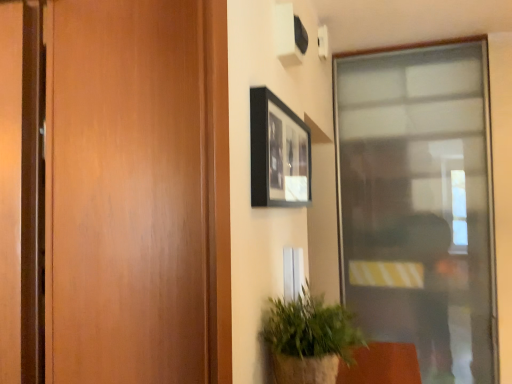
Question: Can you confirm if black matte picture frame at upper center is smaller than transparent glass door at right?

Choices:
 (A) no
 (B) yes

Answer: (B)

Question: From the image's perspective, does black matte picture frame at upper center appear higher than transparent glass door at right?

Choices:
 (A) no
 (B) yes

Answer: (B)

Question: Could transparent glass door at right be considered to be inside black matte picture frame at upper center?

Choices:
 (A) yes
 (B) no

Answer: (B)

Question: Does black matte picture frame at upper center have a greater height compared to transparent glass door at right?

Choices:
 (A) yes
 (B) no

Answer: (B)

Question: Can you confirm if black matte picture frame at upper center is wider than transparent glass door at right?

Choices:
 (A) no
 (B) yes

Answer: (A)

Question: From a real-world perspective, relative to transparent glass door at right, is black matte picture frame at upper center vertically above or below?

Choices:
 (A) below
 (B) above

Answer: (B)

Question: Considering the positions of black matte picture frame at upper center and transparent glass door at right in the image, is black matte picture frame at upper center wider or thinner than transparent glass door at right?

Choices:
 (A) thin
 (B) wide

Answer: (A)

Question: Considering their positions, is black matte picture frame at upper center located in front of or behind transparent glass door at right?

Choices:
 (A) front
 (B) behind

Answer: (A)

Question: Considering the relative positions of black matte picture frame at upper center and transparent glass door at right in the image provided, is black matte picture frame at upper center to the left or to the right of transparent glass door at right?

Choices:
 (A) right
 (B) left

Answer: (B)

Question: From the image's perspective, is transparent glass door at right located above or below green textured plant at lower right?

Choices:
 (A) above
 (B) below

Answer: (A)

Question: Considering the relative positions of transparent glass door at right and green textured plant at lower right in the image provided, is transparent glass door at right to the left or to the right of green textured plant at lower right?

Choices:
 (A) left
 (B) right

Answer: (B)

Question: Considering the positions of transparent glass door at right and green textured plant at lower right in the image, is transparent glass door at right taller or shorter than green textured plant at lower right?

Choices:
 (A) short
 (B) tall

Answer: (B)

Question: Considering their positions, is transparent glass door at right located in front of or behind green textured plant at lower right?

Choices:
 (A) front
 (B) behind

Answer: (B)

Question: In terms of height, does green textured plant at lower right look taller or shorter compared to black matte picture frame at upper center?

Choices:
 (A) short
 (B) tall

Answer: (A)

Question: Considering the positions of green textured plant at lower right and black matte picture frame at upper center in the image, is green textured plant at lower right bigger or smaller than black matte picture frame at upper center?

Choices:
 (A) big
 (B) small

Answer: (A)